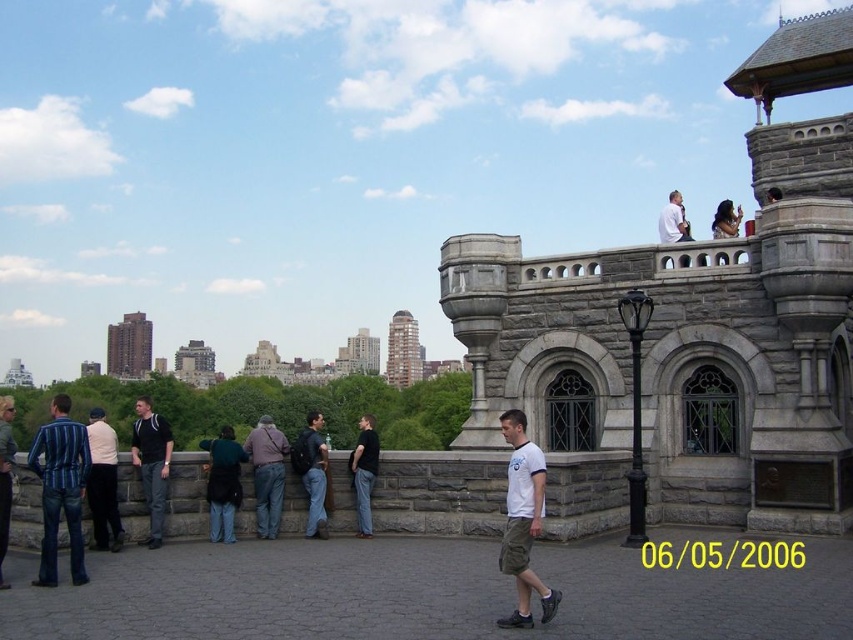
Based on the photo, you are a photographer aiming to capture a candid shot of the people at the overlook. You notice the brown leather jacket at center and the dark blue jeans at center. Which clothing item is positioned higher on the person?

The brown leather jacket at center is located above dark blue jeans at center, so the jacket is higher on the person.

You are a photographer trying to capture a candid shot of the dark gray jeans at center and the denim jacket at left. Since you want to ensure both are clearly visible, which object should you focus on first to account for their sizes?

The dark gray jeans at center is smaller than the denim jacket at left, so you should focus on the dark gray jeans at center first to ensure its details are captured clearly before adjusting for the larger denim jacket at left.